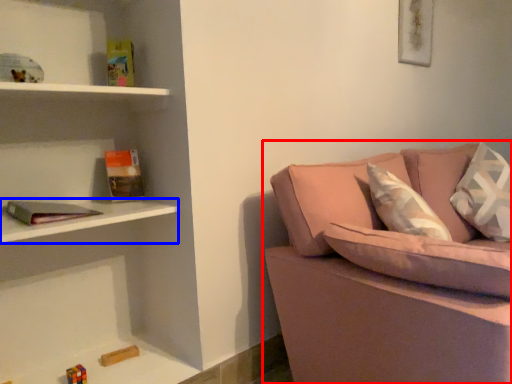
Question: Which point is closer to the camera, studio couch (highlighted by a red box) or cabinet (highlighted by a blue box)?

Choices:
 (A) studio couch
 (B) cabinet

Answer: (A)